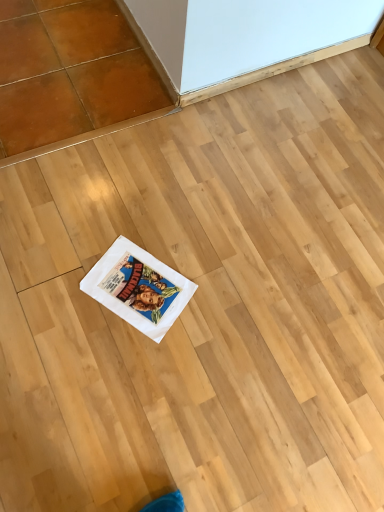
I want to click on vacant area situated below white paper comic book at center (from a real-world perspective), so [142, 284].